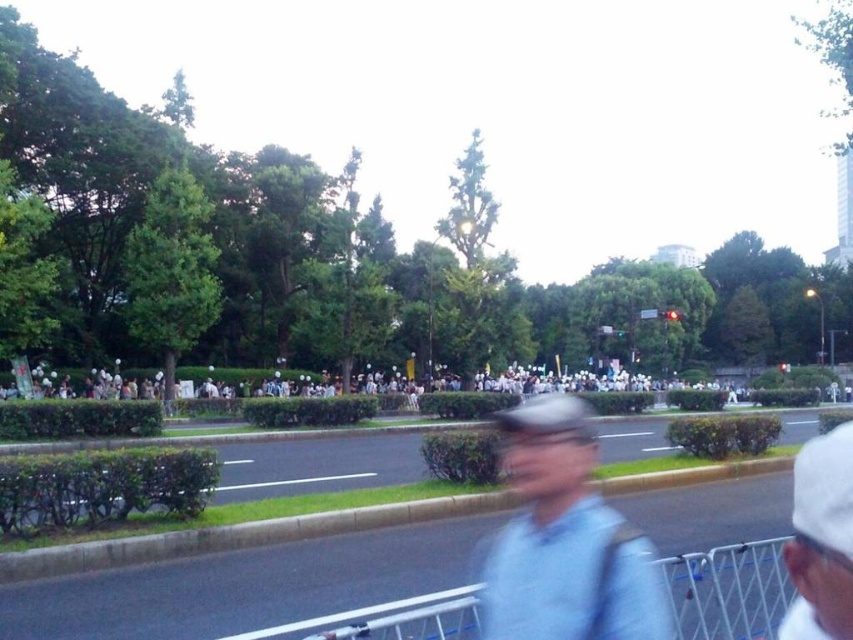
You are a photographer trying to capture a clear image of the light blue fabric at center and the white metal rail at lower center. Which object should you adjust your camera focus on first if you want to ensure both are in focus, considering their positions?

The light blue fabric at center is to the right of the white metal rail at lower center. To ensure both are in focus, adjust your camera focus on the white metal rail at lower center first since it is closer to the camera, and the light blue fabric at center will naturally fall into focus as it is further away.

You are a photographer trying to capture a clear shot of the light blue fabric at center and the white matte cap at upper right. Given their sizes, which object should you zoom in on to ensure both fit in the frame without cropping?

The light blue fabric at center is bigger than the white matte cap at upper right, so you should zoom out to include both objects without cropping. Zooming in might cause the larger light blue fabric at center to be cut off.

You are a photographer trying to capture a clear shot of the white matte cap at upper right. However, there is a white metal rail at lower center in the way. Can you adjust your position to avoid the rail while still seeing the cap?

Yes, since the white matte cap at upper right is behind the white metal rail at lower center, you can move your position upwards or to the side to see the cap without the rail blocking it.